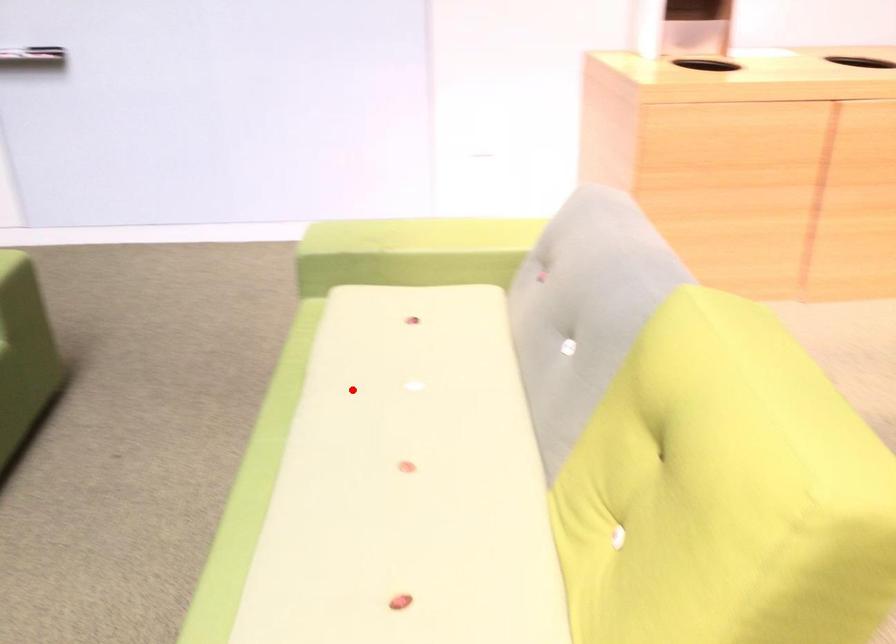
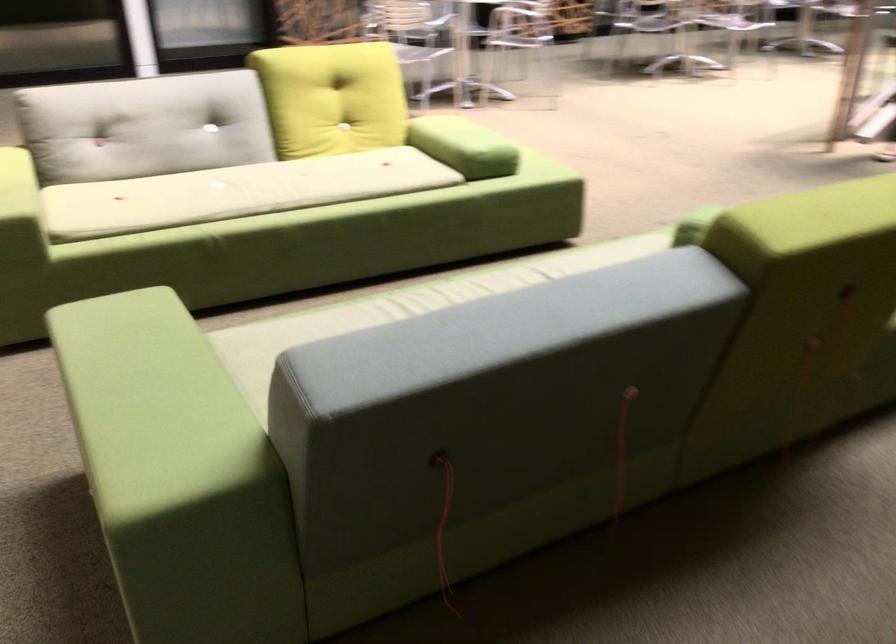
Question: A red point is marked in image1. In image2, is the corresponding 3D point closer to the camera or farther? Reply with the corresponding letter.

Choices:
 (A) The corresponding 3D point is closer.
 (B) The corresponding 3D point is farther.

Answer: (B)